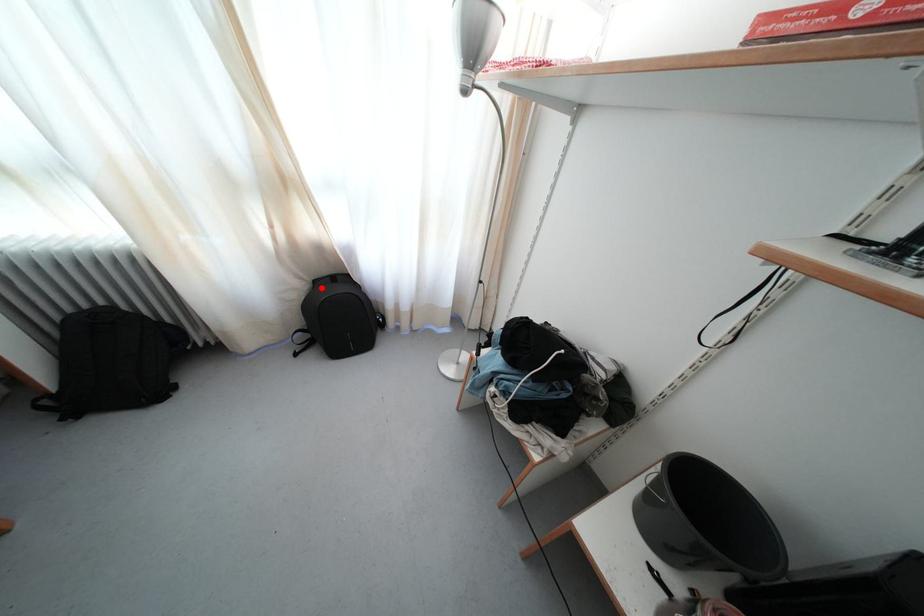
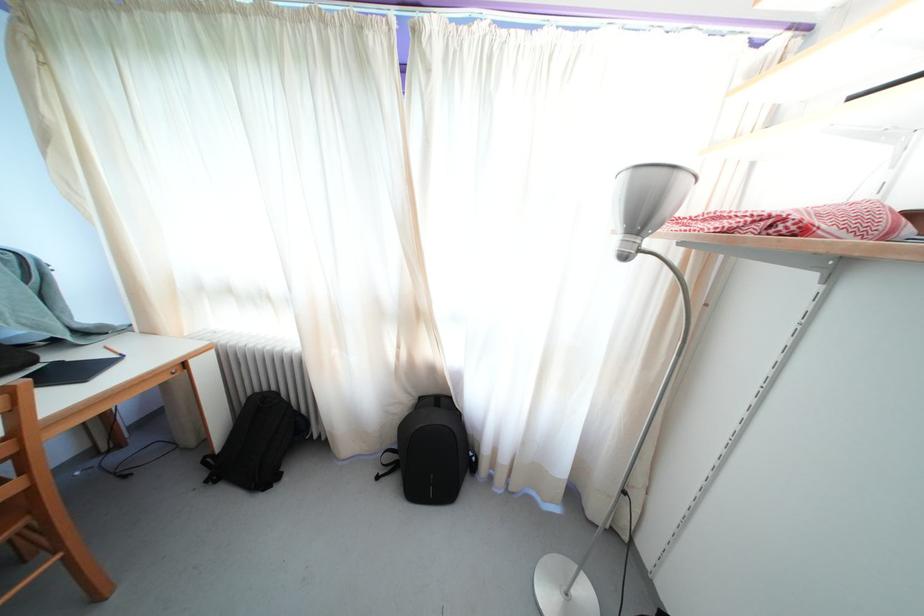
Question: I am providing you with two images of the same scene from different viewpoints. Given a red point in image1, look at the same physical point in image2. Is it:

Choices:
 (A) Closer to the viewpoint
 (B) Farther from the viewpoint

Answer: (B)